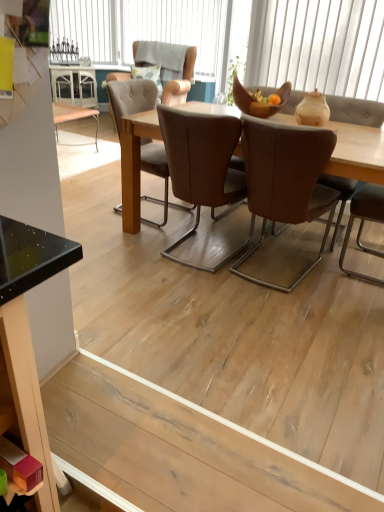
At what (x,y) coordinates should I click in order to perform the action: click on free space on the front side of brown leather chair at center, the second chair from the top. Please return your answer as a coordinate pair (x, y). Looking at the image, I should click on (206, 298).